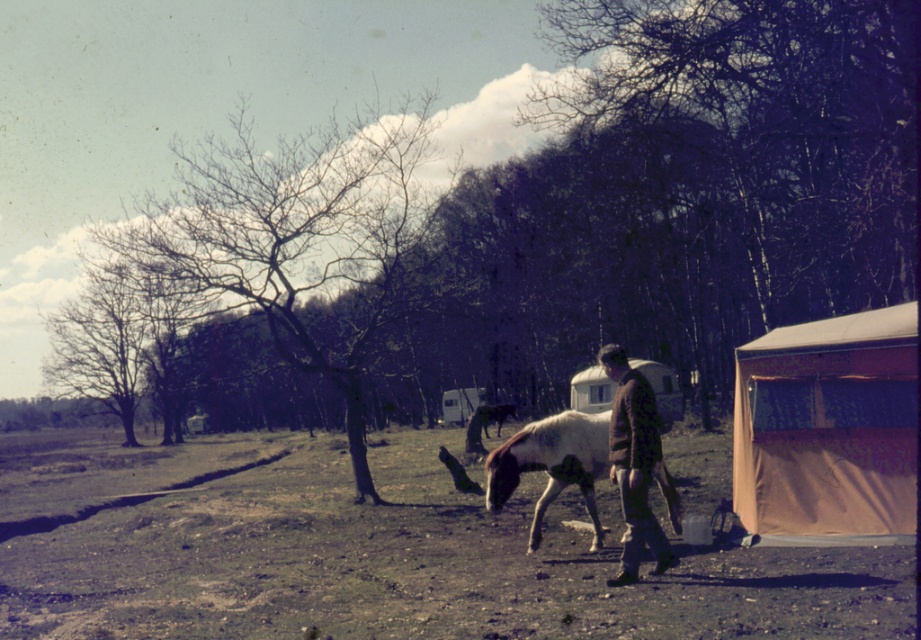
Is point (913, 531) in front of point (504, 404)?

That is True.

Locate an element on the screen. tan canvas tent at lower right is located at coordinates (828, 426).

Which is behind, point (557, 465) or point (607, 371)?

Positioned behind is point (557, 465).

Which is more to the right, white and brown speckled horse at center or brown woolen sweater at center?

From the viewer's perspective, brown woolen sweater at center appears more on the right side.

At what (x,y) coordinates should I click in order to perform the action: click on white and brown speckled horse at center. Please return your answer as a coordinate pair (x, y). The height and width of the screenshot is (640, 921). Looking at the image, I should click on (552, 465).

Is white and brown speckled horse at center to the right of pink fabric tent at right from the viewer's perspective?

Incorrect, white and brown speckled horse at center is not on the right side of pink fabric tent at right.

Is white and brown speckled horse at center thinner than pink fabric tent at right?

Yes, white and brown speckled horse at center is thinner than pink fabric tent at right.

Locate an element on the screen. white and brown speckled horse at center is located at coordinates (552, 465).